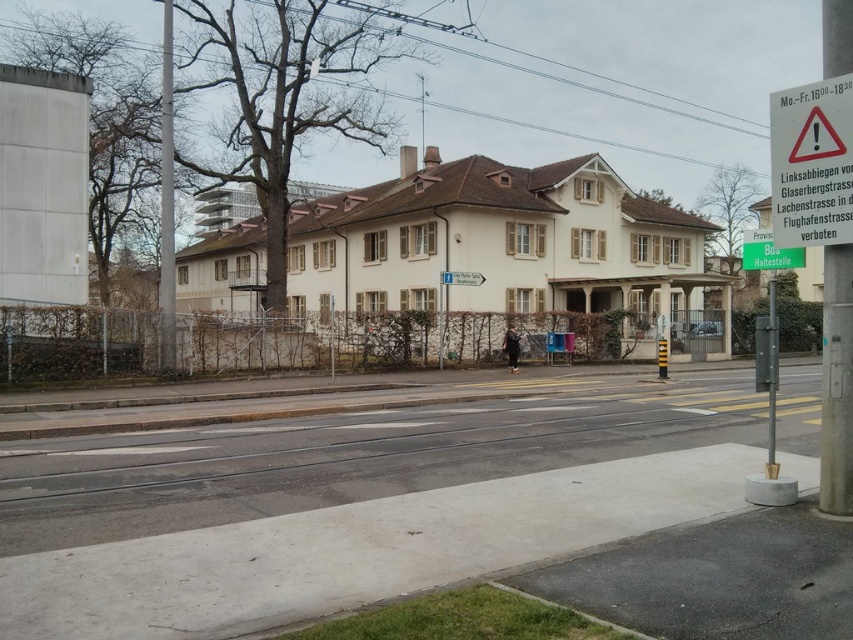
You are standing at the point marked as point (811, 163) and want to walk towards the white plastic sign at upper right. Is the sign located in front of or behind you?

The white plastic sign at upper right is located at point (811, 163), so you are already at the sign.

Based on the photo, you are a delivery person needing to attach a package to either the white plastic sign at upper right or the metallic pole at left. Which object can hold a larger package based on their widths?

The metallic pole at left has a greater width than the white plastic sign at upper right, so it can hold a larger package.